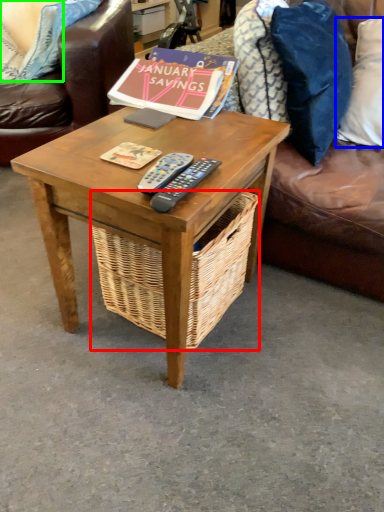
Question: Considering the real-world distances, which object is closest to picnic basket (highlighted by a red box)? pillow (highlighted by a blue box) or pillow (highlighted by a green box).

Choices:
 (A) pillow
 (B) pillow

Answer: (A)